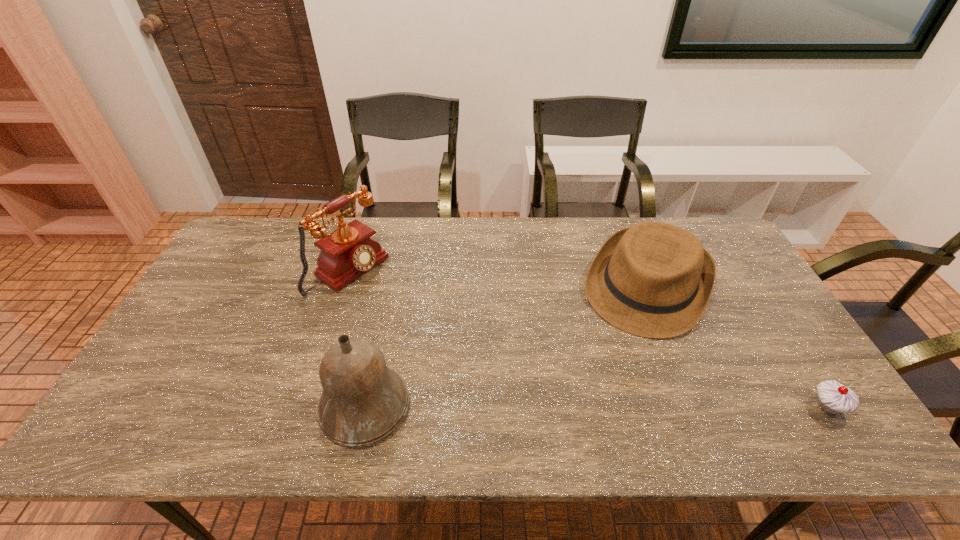
Locate an element on the screen. The image size is (960, 540). free location located on the dial of the telephone is located at coordinates tap(474, 356).

Find the location of a particular element. The image size is (960, 540). vacant space located on the dial of the telephone is located at coordinates (410, 313).

This screenshot has height=540, width=960. Find the location of `free spot located on the dial of the telephone`. free spot located on the dial of the telephone is located at coordinates (396, 303).

Where is `fedora that is at the far edge`? Image resolution: width=960 pixels, height=540 pixels. fedora that is at the far edge is located at coordinates (653, 279).

Find the location of a particular element. The height and width of the screenshot is (540, 960). telephone that is at the far edge is located at coordinates (347, 253).

Find the location of a particular element. bell that is at the near edge is located at coordinates (363, 401).

Where is `cupcake that is at the near edge`? cupcake that is at the near edge is located at coordinates (833, 398).

Where is `cupcake located in the right edge section of the desktop`? This screenshot has height=540, width=960. cupcake located in the right edge section of the desktop is located at coordinates (833, 398).

The height and width of the screenshot is (540, 960). In order to click on fedora located at the right edge in this screenshot , I will do [x=653, y=279].

Where is `object located in the far right corner section of the desktop`? The image size is (960, 540). object located in the far right corner section of the desktop is located at coordinates (653, 279).